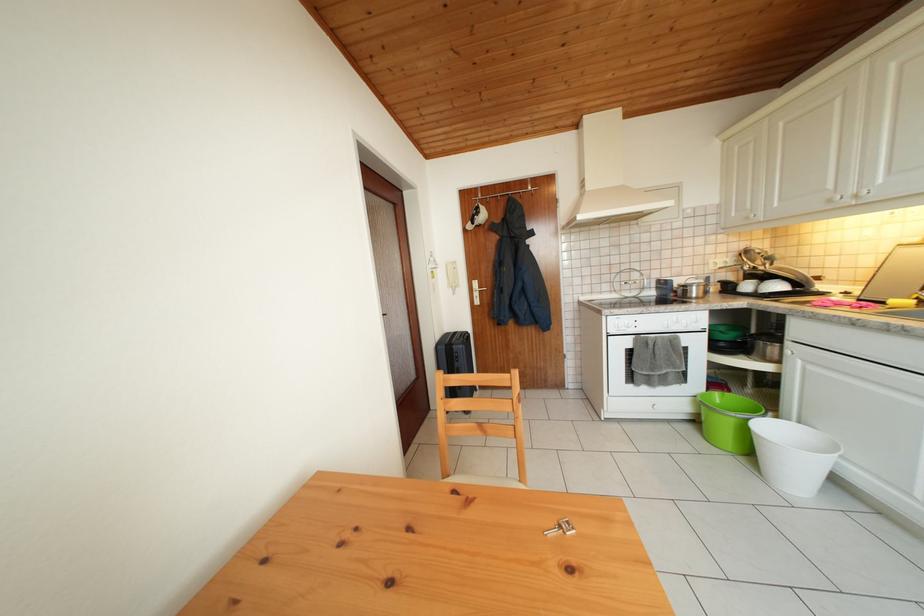
This screenshot has width=924, height=616. In order to click on chair sitting surface in this screenshot , I will do `click(484, 480)`.